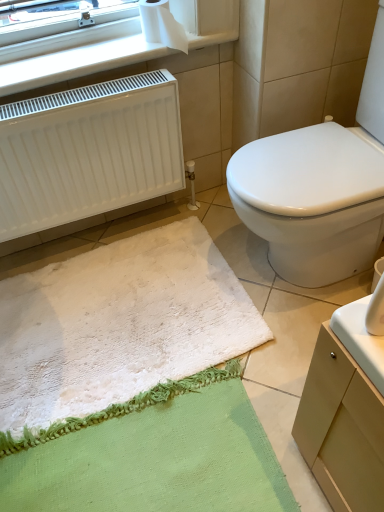
Question: In terms of height, does white fluffy bath mat at lower left look taller or shorter compared to white matte radiator at left?

Choices:
 (A) short
 (B) tall

Answer: (A)

Question: Is point (203, 324) closer or farther from the camera than point (54, 170)?

Choices:
 (A) closer
 (B) farther

Answer: (B)

Question: Which object is positioned closest to the white fluffy bath mat at lower left?

Choices:
 (A) white plastic radiator at upper left
 (B) white paper at upper left
 (C) white glossy toilet at center
 (D) white matte radiator at left

Answer: (D)

Question: Estimate the real-world distances between objects in this image. Which object is farther from the white fluffy bath mat at lower left?

Choices:
 (A) white glossy toilet at center
 (B) white paper at upper left
 (C) white plastic radiator at upper left
 (D) white matte radiator at left

Answer: (B)